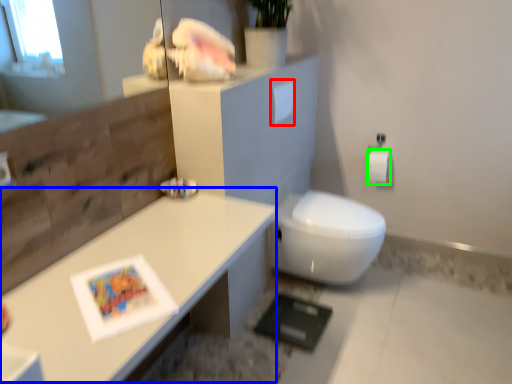
Question: Considering the real-world distances, which object is farthest from toilet paper (highlighted by a red box)? table (highlighted by a blue box) or toilet paper (highlighted by a green box)?

Choices:
 (A) table
 (B) toilet paper

Answer: (A)